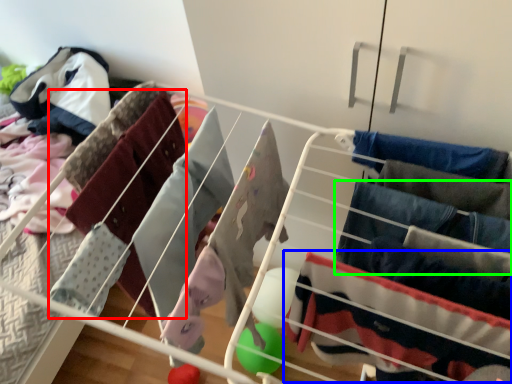
Question: Which object is positioned farthest from clothing (highlighted by a red box)? Select from clothing (highlighted by a blue box) and clothing (highlighted by a green box).

Choices:
 (A) clothing
 (B) clothing

Answer: (B)